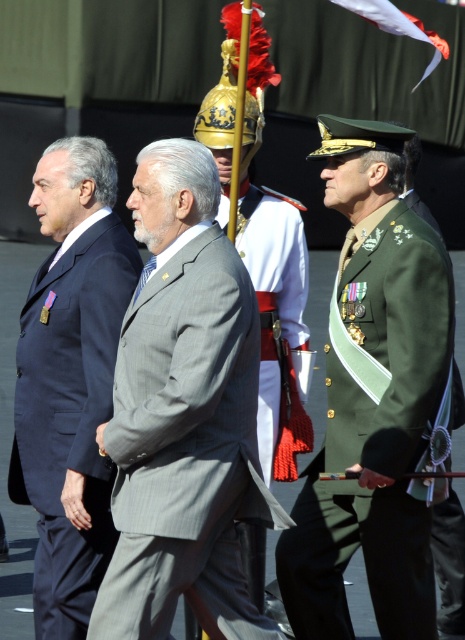
Does green military uniform at center appear under matte black suit at left?

No, green military uniform at center is not below matte black suit at left.

This screenshot has width=465, height=640. I want to click on green military uniform at center, so click(x=373, y=397).

Who is higher up, gray pinstripe suit at center or matte black suit at left?

matte black suit at left

Locate an element on the screen. The height and width of the screenshot is (640, 465). gray pinstripe suit at center is located at coordinates (184, 416).

Is point (201, 468) more distant than point (39, 180)?

No, it is not.

Where is `gray pinstripe suit at center`? The image size is (465, 640). gray pinstripe suit at center is located at coordinates (184, 416).

Is green military uniform at center closer to camera compared to white fabric flag at upper center?

Yes, it is.

I want to click on green military uniform at center, so click(373, 397).

You are a GUI agent. You are given a task and a screenshot of the screen. Output one action in this format:
    pyautogui.click(x=<x>, y=<y>)
    Task: Click on the green military uniform at center
    This screenshot has width=465, height=640.
    Given the screenshot: What is the action you would take?
    pyautogui.click(x=373, y=397)